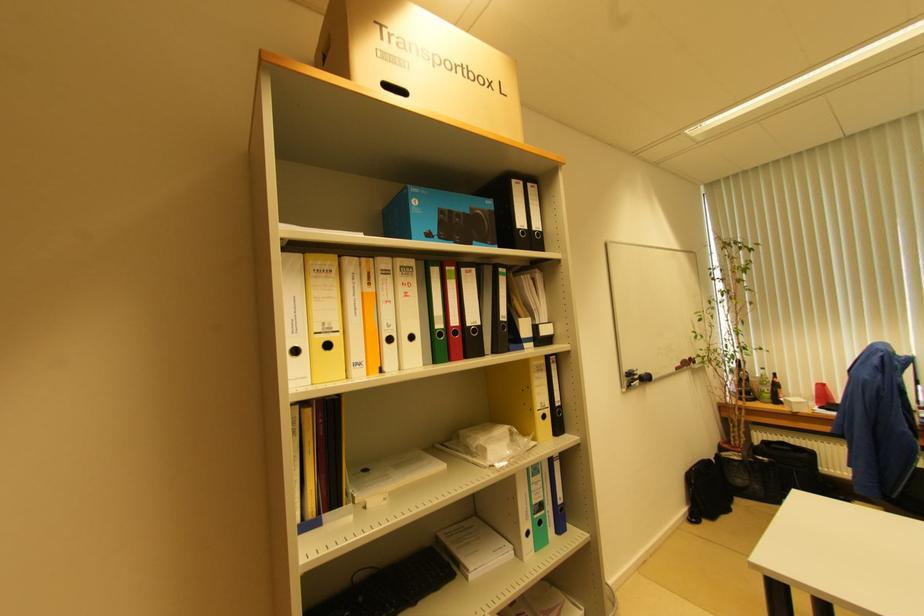
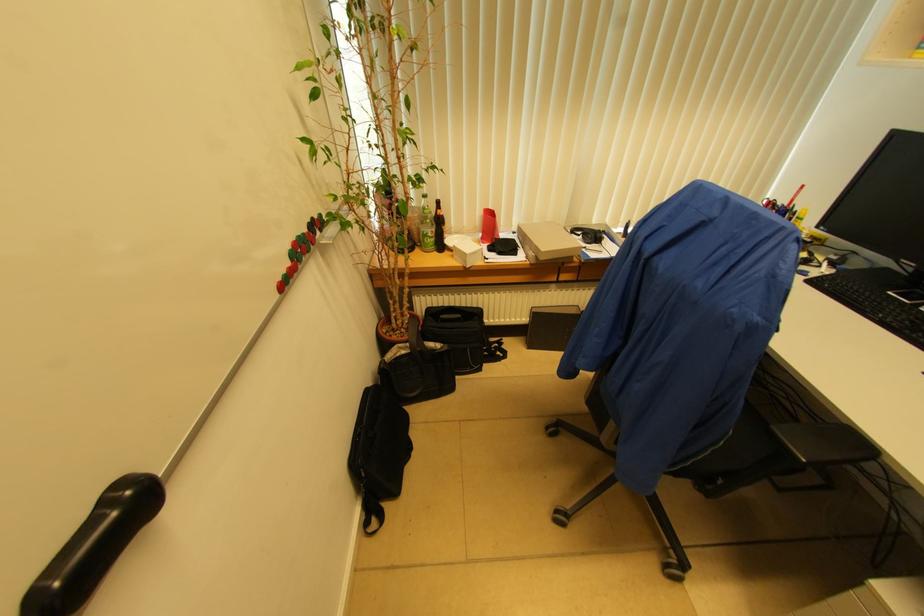
Find the pixel in the second image that matches point 728,513 in the first image.

(409, 451)